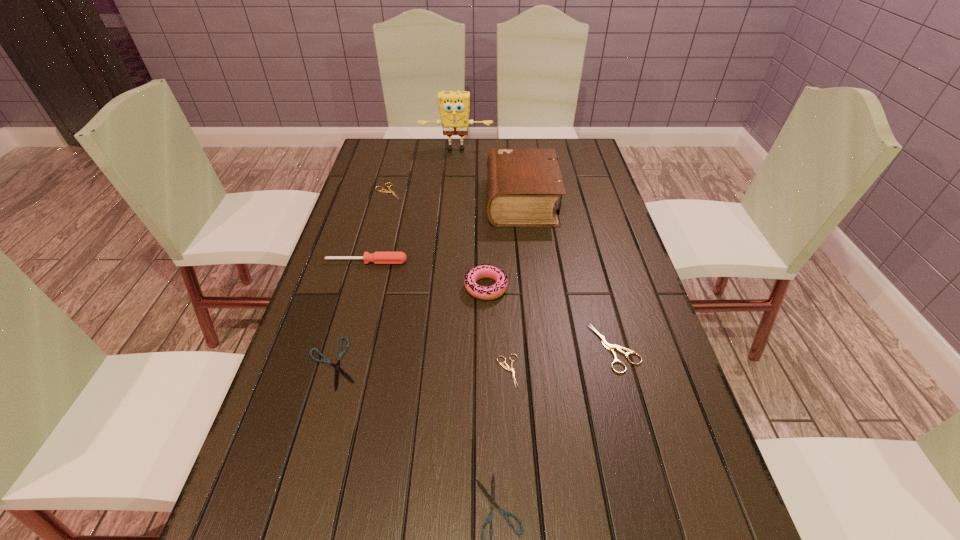
Locate an element on the screen. This screenshot has width=960, height=540. the leftmost beige shears is located at coordinates (382, 190).

You are a GUI agent. You are given a task and a screenshot of the screen. Output one action in this format:
    pyautogui.click(x=<x>, y=<y>)
    Task: Click on the bigger black shears
    Image resolution: width=960 pixels, height=540 pixels.
    Given the screenshot: What is the action you would take?
    pyautogui.click(x=337, y=366)

The image size is (960, 540). What are the coordinates of `the left black shears` in the screenshot? It's located at (337, 366).

The image size is (960, 540). I want to click on the second beige shears from left to right, so click(x=506, y=367).

The height and width of the screenshot is (540, 960). Find the location of `vacant space located 0.120m on the face of the tallest object`. vacant space located 0.120m on the face of the tallest object is located at coordinates (454, 171).

Image resolution: width=960 pixels, height=540 pixels. In order to click on vacant space situated on the spine side of the second tallest object in this screenshot , I will do `click(396, 201)`.

The image size is (960, 540). Find the location of `free space located 0.210m on the spine side of the second tallest object`. free space located 0.210m on the spine side of the second tallest object is located at coordinates (x=423, y=201).

I want to click on free space located on the spine side of the second tallest object, so click(x=447, y=201).

The width and height of the screenshot is (960, 540). Find the location of `free space located 0.090m on the front of the seventh shortest object`. free space located 0.090m on the front of the seventh shortest object is located at coordinates (487, 330).

Where is `free space located 0.060m on the back of the sixth shortest object`? free space located 0.060m on the back of the sixth shortest object is located at coordinates (372, 245).